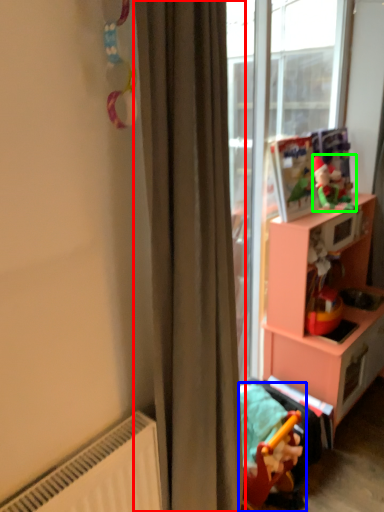
Question: Based on their relative distances, which object is nearer to curtain (highlighted by a red box)? Choose from toy (highlighted by a blue box) and toy (highlighted by a green box).

Choices:
 (A) toy
 (B) toy

Answer: (A)